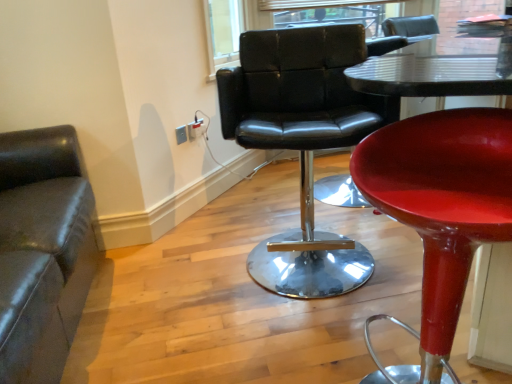
I want to click on black leather chair at center, placed as the second chair when sorted from right to left, so click(302, 142).

Identify the location of shiny red stool at center, the third chair when ordered from left to right. (439, 213).

Considering the relative sizes of white plastic electrical outlet at upper center, which appears as the first electric outlet when viewed from the back, and shiny red stool at center, the third chair when ordered from left to right, in the image provided, is white plastic electrical outlet at upper center, which appears as the first electric outlet when viewed from the back, taller than shiny red stool at center, the third chair when ordered from left to right,?

Incorrect, the height of white plastic electrical outlet at upper center, which appears as the first electric outlet when viewed from the back, is not larger of that of shiny red stool at center, the third chair when ordered from left to right.

From a real-world perspective, is white plastic electrical outlet at upper center, which appears as the first electric outlet when viewed from the back, below shiny red stool at center, the third chair when ordered from left to right?

Actually, white plastic electrical outlet at upper center, which appears as the first electric outlet when viewed from the back, is physically above shiny red stool at center, the third chair when ordered from left to right, in the real world.

Is white plastic electrical outlet at upper center, which appears as the first electric outlet when viewed from the back, facing away from shiny red stool at center, the 1th chair in the right-to-left sequence?

white plastic electrical outlet at upper center, which appears as the first electric outlet when viewed from the back, does not have its back to shiny red stool at center, the 1th chair in the right-to-left sequence.

How distant is white plastic electrical outlet at upper center, the 2th electric outlet from the front, from shiny red stool at center, the third chair when ordered from left to right?

white plastic electrical outlet at upper center, the 2th electric outlet from the front, and shiny red stool at center, the third chair when ordered from left to right, are 1.67 meters apart from each other.

In the scene shown: Does shiny red stool at center, the 1th chair in the right-to-left sequence, turn towards clear glass window at upper center?

No, shiny red stool at center, the 1th chair in the right-to-left sequence, is not aimed at clear glass window at upper center.

Between shiny red stool at center, the 1th chair in the right-to-left sequence, and clear glass window at upper center, which one has larger size?

Bigger between the two is shiny red stool at center, the 1th chair in the right-to-left sequence.

From a real-world perspective, is shiny red stool at center, the third chair when ordered from left to right, above or below clear glass window at upper center?

Clearly, from a real-world perspective, shiny red stool at center, the third chair when ordered from left to right, is below clear glass window at upper center.

From the image's perspective, is clear glass window at upper center under matte white electrical outlet at upper center, the 2th electric outlet viewed from the back?

Actually, clear glass window at upper center appears above matte white electrical outlet at upper center, the 2th electric outlet viewed from the back, in the image.

Is clear glass window at upper center inside or outside of matte white electrical outlet at upper center, which is the first electric outlet from front to back?

clear glass window at upper center exists outside the volume of matte white electrical outlet at upper center, which is the first electric outlet from front to back.

From a real-world perspective, is clear glass window at upper center physically located above or below matte white electrical outlet at upper center, the 2th electric outlet viewed from the back?

From a real-world perspective, clear glass window at upper center is physically above matte white electrical outlet at upper center, the 2th electric outlet viewed from the back.

Is matte black leather chair at left, which is the 3th chair from right to left, facing towards black leather chair at center, placed as the second chair when sorted from right to left?

Yes, matte black leather chair at left, which is the 3th chair from right to left, is facing black leather chair at center, placed as the second chair when sorted from right to left.

Does matte black leather chair at left, the 1th chair from the left, touch black leather chair at center, the 2th chair viewed from the left?

matte black leather chair at left, the 1th chair from the left, and black leather chair at center, the 2th chair viewed from the left, are not in contact.

Which is more to the right, matte black leather chair at left, which is the 3th chair from right to left, or black leather chair at center, placed as the second chair when sorted from right to left?

From the viewer's perspective, black leather chair at center, placed as the second chair when sorted from right to left, appears more on the right side.

From the picture: Who is smaller, matte black leather chair at left, which is the 3th chair from right to left, or black leather chair at center, the 2th chair viewed from the left?

black leather chair at center, the 2th chair viewed from the left.

Could you tell me if clear glass window at upper center is facing shiny red stool at center, the 1th chair in the right-to-left sequence?

No, clear glass window at upper center is not turned towards shiny red stool at center, the 1th chair in the right-to-left sequence.

Considering the sizes of objects clear glass window at upper center and shiny red stool at center, the third chair when ordered from left to right, in the image provided, who is taller, clear glass window at upper center or shiny red stool at center, the third chair when ordered from left to right,?

shiny red stool at center, the third chair when ordered from left to right, is taller.

From the image's perspective, is clear glass window at upper center above or below shiny red stool at center, the 1th chair in the right-to-left sequence?

Based on their image positions, clear glass window at upper center is located above shiny red stool at center, the 1th chair in the right-to-left sequence.

Locate an element on the screen. This screenshot has height=384, width=512. window behind the shiny red stool at center, the third chair when ordered from left to right is located at coordinates (330, 12).

Does black leather chair at center, placed as the second chair when sorted from right to left, appear on the right side of white plastic electrical outlet at upper center, which appears as the first electric outlet when viewed from the back?

Yes, black leather chair at center, placed as the second chair when sorted from right to left, is to the right of white plastic electrical outlet at upper center, which appears as the first electric outlet when viewed from the back.

Is black leather chair at center, placed as the second chair when sorted from right to left, facing towards white plastic electrical outlet at upper center, which appears as the first electric outlet when viewed from the back?

No, black leather chair at center, placed as the second chair when sorted from right to left, does not turn towards white plastic electrical outlet at upper center, which appears as the first electric outlet when viewed from the back.

Based on the photo, do you think shiny red stool at center, the 1th chair in the right-to-left sequence, is within matte black leather chair at left, the 1th chair from the left, or outside of it?

shiny red stool at center, the 1th chair in the right-to-left sequence, is outside matte black leather chair at left, the 1th chair from the left.

From a real-world perspective, which is physically below, shiny red stool at center, the third chair when ordered from left to right, or matte black leather chair at left, which is the 3th chair from right to left?

shiny red stool at center, the third chair when ordered from left to right, is physically lower.

Based on the photo, is shiny red stool at center, the 1th chair in the right-to-left sequence, looking in the opposite direction of matte black leather chair at left, the 1th chair from the left?

shiny red stool at center, the 1th chair in the right-to-left sequence, does not have its back to matte black leather chair at left, the 1th chair from the left.

From a real-world perspective, which electric outlet is the 2nd one above the shiny red stool at center, the third chair when ordered from left to right? Please provide its 2D coordinates.

[(193, 130)]

From the image's perspective, starting from the clear glass window at upper center, which chair is the 3rd one below? Please provide its 2D coordinates.

[(439, 213)]

From the image, which object appears to be nearer to matte black leather chair at left, which is the 3th chair from right to left, black leather chair at center, the 2th chair viewed from the left, or shiny red stool at center, the 1th chair in the right-to-left sequence?

black leather chair at center, the 2th chair viewed from the left, lies closer to matte black leather chair at left, which is the 3th chair from right to left, than the other object.

When comparing their distances from white plastic electrical outlet at upper center, the 2th electric outlet from the front, does shiny red stool at center, the third chair when ordered from left to right, or matte white electrical outlet at upper center, which is the first electric outlet from front to back, seem closer?

The object closer to white plastic electrical outlet at upper center, the 2th electric outlet from the front, is matte white electrical outlet at upper center, which is the first electric outlet from front to back.

When comparing their distances from clear glass window at upper center, does matte white electrical outlet at upper center, the 2th electric outlet viewed from the back, or black leather chair at center, placed as the second chair when sorted from right to left, seem further?

The object further to clear glass window at upper center is black leather chair at center, placed as the second chair when sorted from right to left.

Estimate the real-world distances between objects in this image. Which object is closer to shiny red stool at center, the third chair when ordered from left to right, matte black leather chair at left, which is the 3th chair from right to left, or black leather chair at center, placed as the second chair when sorted from right to left?

black leather chair at center, placed as the second chair when sorted from right to left, lies closer to shiny red stool at center, the third chair when ordered from left to right, than the other object.

From the picture: Based on their spatial positions, is matte black leather chair at left, which is the 3th chair from right to left, or white plastic electrical outlet at upper center, the 2th electric outlet from the front, further from shiny red stool at center, the third chair when ordered from left to right?

white plastic electrical outlet at upper center, the 2th electric outlet from the front, lies further to shiny red stool at center, the third chair when ordered from left to right, than the other object.

Estimate the real-world distances between objects in this image. Which object is closer to shiny red stool at center, the third chair when ordered from left to right, white plastic electrical outlet at upper center, which appears as the first electric outlet when viewed from the back, or matte white electrical outlet at upper center, the 2th electric outlet viewed from the back?

matte white electrical outlet at upper center, the 2th electric outlet viewed from the back, lies closer to shiny red stool at center, the third chair when ordered from left to right, than the other object.

From the image, which object appears to be nearer to clear glass window at upper center, matte black leather chair at left, which is the 3th chair from right to left, or shiny red stool at center, the 1th chair in the right-to-left sequence?

The object closer to clear glass window at upper center is matte black leather chair at left, which is the 3th chair from right to left.

Estimate the real-world distances between objects in this image. Which object is closer to white plastic electrical outlet at upper center, the 2th electric outlet from the front, matte black leather chair at left, the 1th chair from the left, or black leather chair at center, the 2th chair viewed from the left?

black leather chair at center, the 2th chair viewed from the left.

Find the location of `chair between matte black leather chair at left, the 1th chair from the left, and shiny red stool at center, the third chair when ordered from left to right, in the horizontal direction`. chair between matte black leather chair at left, the 1th chair from the left, and shiny red stool at center, the third chair when ordered from left to right, in the horizontal direction is located at coordinates (302, 142).

Find the location of a particular element. electric outlet between black leather chair at center, the 2th chair viewed from the left, and white plastic electrical outlet at upper center, which appears as the first electric outlet when viewed from the back, in the front-back direction is located at coordinates (181, 134).

You are a GUI agent. You are given a task and a screenshot of the screen. Output one action in this format:
    pyautogui.click(x=<x>, y=<y>)
    Task: Click on the chair between shiny red stool at center, the third chair when ordered from left to right, and white plastic electrical outlet at upper center, which appears as the first electric outlet when viewed from the back, in the front-back direction
    Image resolution: width=512 pixels, height=384 pixels.
    Given the screenshot: What is the action you would take?
    pyautogui.click(x=302, y=142)

Find the location of a particular element. chair between shiny red stool at center, the 1th chair in the right-to-left sequence, and clear glass window at upper center, along the z-axis is located at coordinates (302, 142).